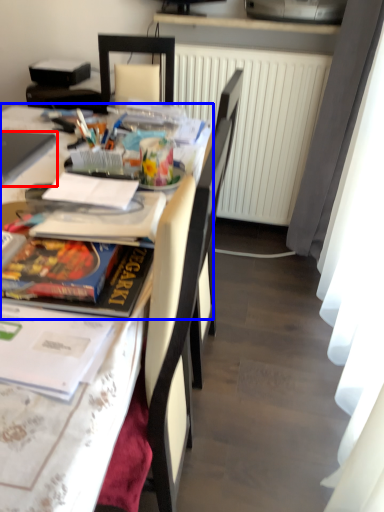
Question: Which object is closer to the camera taking this photo, laptop (highlighted by a red box) or table (highlighted by a blue box)?

Choices:
 (A) laptop
 (B) table

Answer: (B)